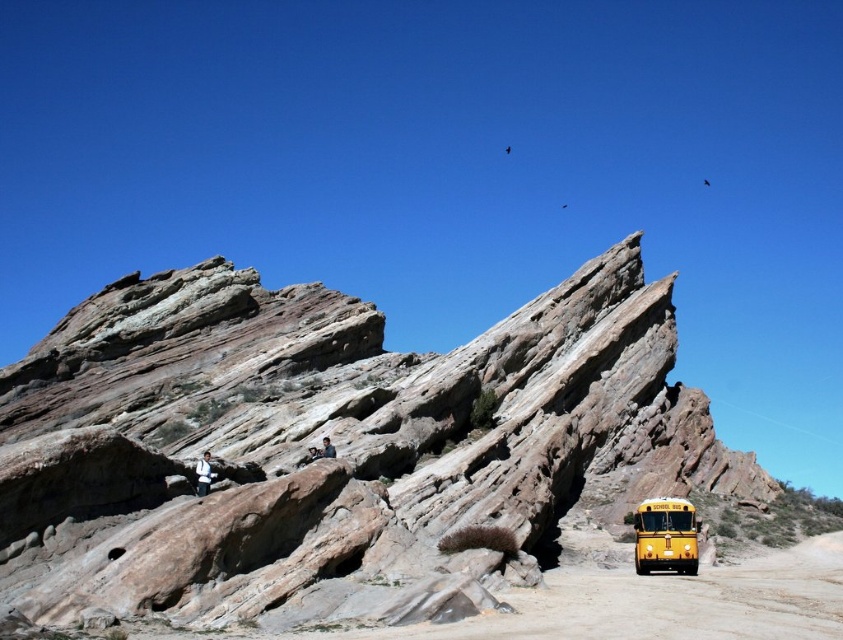
You are standing at the point marked as point (x=334, y=445) in the image. What type of rock formation are you standing on?

You are standing on a rusty rock formation at center.

You are standing at the base of the tilted rock formations and want to take a photo of the two points marked in the scene. Which point, point (x=143, y=426) or point (x=637, y=573), will appear closer to the camera in your photo?

Point (x=143, y=426) will appear closer to the camera in your photo because it is further to the camera than point (x=637, y=573).